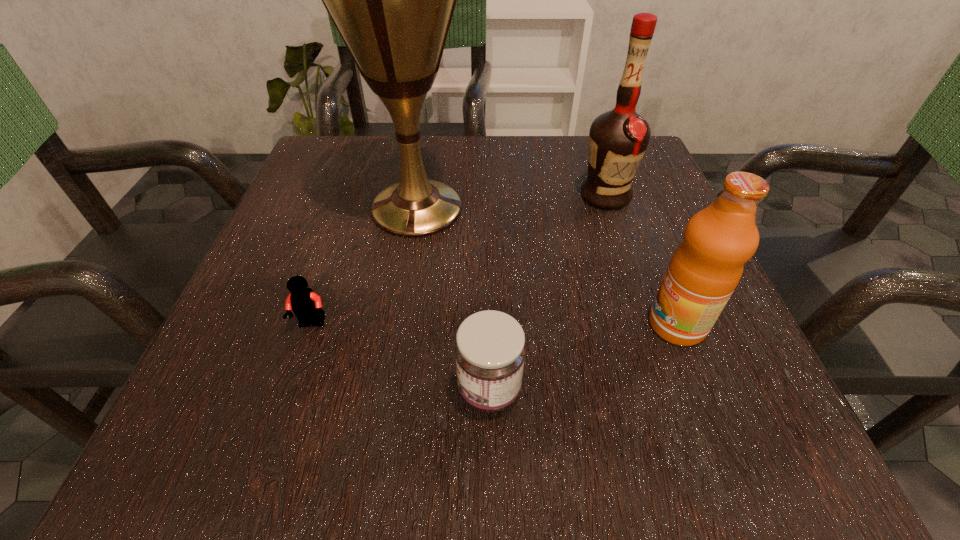
The height and width of the screenshot is (540, 960). Find the location of `liquor located in the right edge section of the desktop`. liquor located in the right edge section of the desktop is located at coordinates (618, 139).

Locate an element on the screen. fruit juice located in the right edge section of the desktop is located at coordinates (705, 269).

You are a GUI agent. You are given a task and a screenshot of the screen. Output one action in this format:
    pyautogui.click(x=<x>, y=<y>)
    Task: Click on the object situated at the far left corner
    The height and width of the screenshot is (540, 960).
    Given the screenshot: What is the action you would take?
    pyautogui.click(x=392, y=0)

This screenshot has width=960, height=540. Identify the location of object present at the far right corner. (618, 139).

Image resolution: width=960 pixels, height=540 pixels. In order to click on free space at the far edge of the desktop in this screenshot , I will do `click(501, 169)`.

At what (x,y) coordinates should I click in order to perform the action: click on free space at the near edge. Please return your answer as a coordinate pair (x, y). This screenshot has width=960, height=540. Looking at the image, I should click on pos(461,434).

This screenshot has width=960, height=540. Identify the location of free space at the left edge. (262, 307).

I want to click on free space at the right edge of the desktop, so click(x=602, y=244).

I want to click on free space at the far left corner of the desktop, so click(x=361, y=143).

The height and width of the screenshot is (540, 960). I want to click on vacant region at the near left corner of the desktop, so click(198, 404).